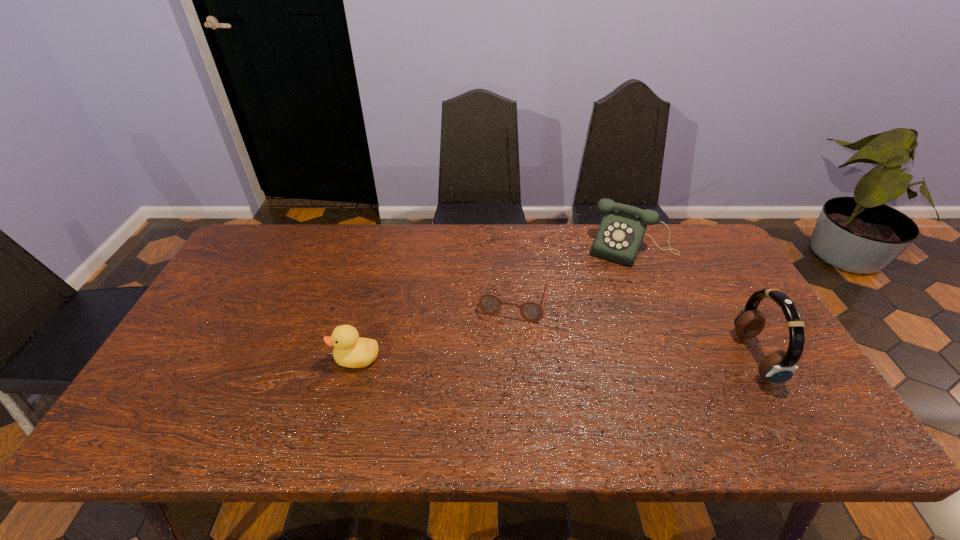
Where is `vacant space on the desktop that is between the duckling and the headset and is positioned on the dial of the telephone`? vacant space on the desktop that is between the duckling and the headset and is positioned on the dial of the telephone is located at coordinates (587, 357).

Where is `vacant space on the desktop that is between the leftmost object and the rightmost object and is positioned on the front-facing side of the third nearest object`? The image size is (960, 540). vacant space on the desktop that is between the leftmost object and the rightmost object and is positioned on the front-facing side of the third nearest object is located at coordinates (498, 357).